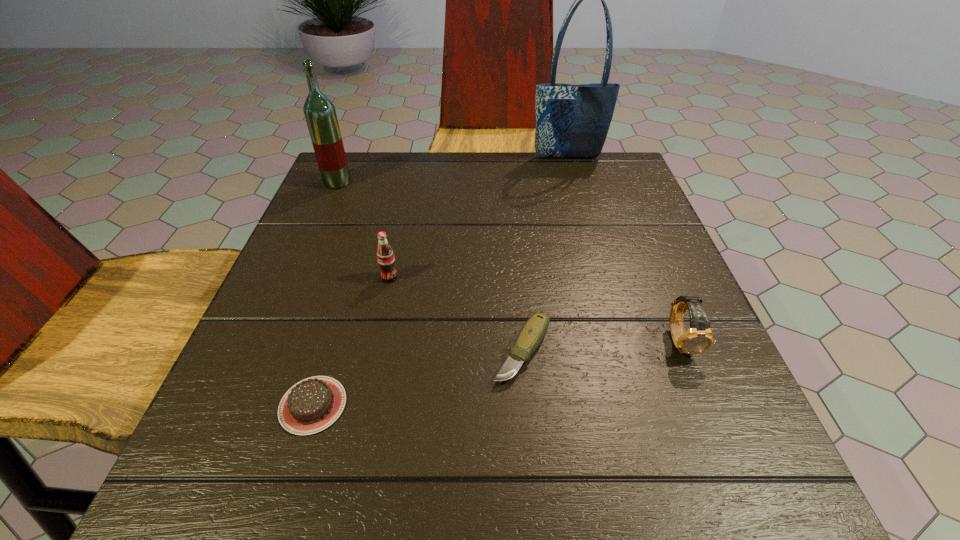
The width and height of the screenshot is (960, 540). Find the location of `empty location between the fourth object from left to right and the second object from left to right`. empty location between the fourth object from left to right and the second object from left to right is located at coordinates (418, 378).

I want to click on free space between the chocolate cake and the fourth tallest object, so click(x=496, y=373).

Locate an element on the screen. The height and width of the screenshot is (540, 960). empty space that is in between the fourth tallest object and the tallest object is located at coordinates coord(624,249).

The height and width of the screenshot is (540, 960). In order to click on free space between the leftmost object and the pocketknife in this screenshot , I will do `click(430, 266)`.

Where is `free space between the watch and the fourth object from right to left`? free space between the watch and the fourth object from right to left is located at coordinates (535, 309).

The image size is (960, 540). Identify the location of vacant area between the second tallest object and the watch. (509, 261).

The image size is (960, 540). What are the coordinates of `free spot between the third object from left to right and the watch` in the screenshot? It's located at (535, 309).

At what (x,y) coordinates should I click in order to perform the action: click on unoccupied position between the fourth object from right to left and the farthest object. Please return your answer as a coordinate pair (x, y). Looking at the image, I should click on (479, 218).

Where is `empty location between the shopping bag and the watch`? empty location between the shopping bag and the watch is located at coordinates (624, 249).

This screenshot has width=960, height=540. Find the location of `free space between the pocketknife and the fourth shortest object`. free space between the pocketknife and the fourth shortest object is located at coordinates (456, 314).